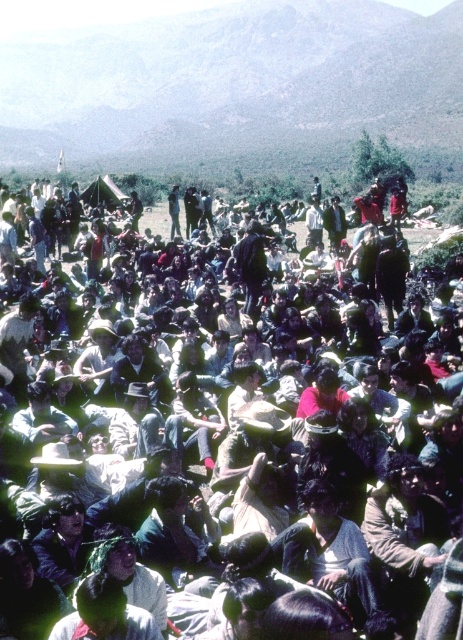
You are a photographer trying to capture a photo of the dark clothing crowd at center from the green grassy hillside at upper center. Can you stand on the hillside to get a clear view of the crowd?

The green grassy hillside at upper center is taller than the dark clothing crowd at center, so yes, you can stand on the green grassy hillside at upper center to get a clear view of the dark clothing crowd at center since it is elevated higher.

You are a photographer standing at the base of the green grassy hillside at upper center. You want to take a photo of the dark clothing crowd at center. Based on the distance between them, can you estimate how far you need to move forward to capture the crowd in your shot?

The green grassy hillside at upper center is 130.42 meters away from the dark clothing crowd at center. Since you are at the base of the hillside, you need to move forward approximately 130.42 meters to reach the crowd, ensuring they are in your shot.